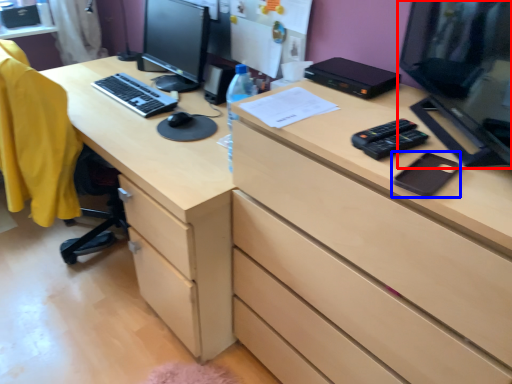
Question: Which object is closer to the camera taking this photo, computer monitor (highlighted by a red box) or notepad (highlighted by a blue box)?

Choices:
 (A) computer monitor
 (B) notepad

Answer: (A)